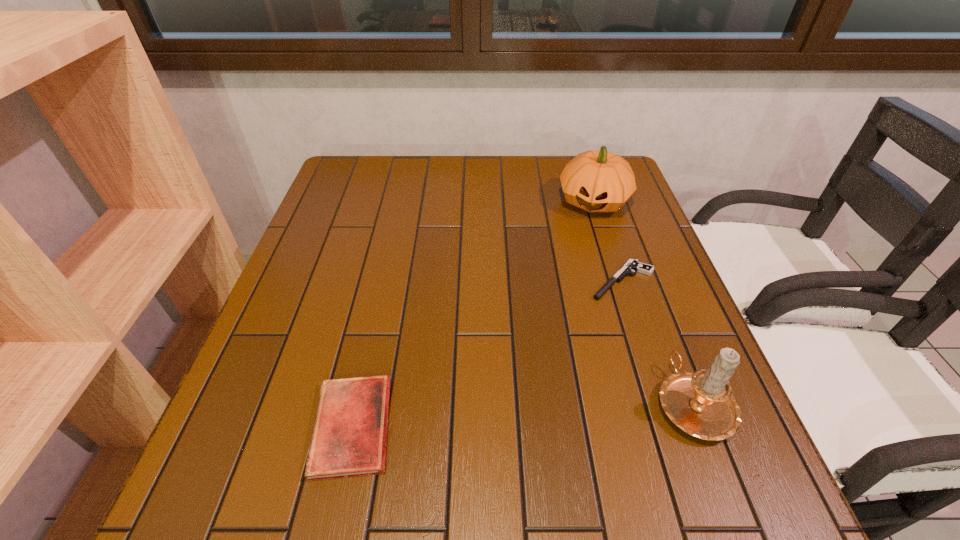
Locate an element on the screen. This screenshot has height=540, width=960. diary is located at coordinates (349, 438).

The height and width of the screenshot is (540, 960). Identify the location of the third tallest object. (349, 438).

Locate an element on the screen. This screenshot has width=960, height=540. candle is located at coordinates (701, 403).

Locate an element on the screen. The height and width of the screenshot is (540, 960). pistol is located at coordinates (633, 265).

Locate an element on the screen. The image size is (960, 540). the shortest object is located at coordinates (633, 265).

In order to click on gourd in this screenshot , I will do `click(595, 181)`.

The width and height of the screenshot is (960, 540). Find the location of `free space located 0.090m on the back of the diary`. free space located 0.090m on the back of the diary is located at coordinates (372, 342).

Where is `free space located on the left of the candle`? free space located on the left of the candle is located at coordinates (518, 403).

Locate an element on the screen. This screenshot has height=540, width=960. vacant point located on the front-facing side of the shortest object is located at coordinates [514, 393].

At what (x,y) coordinates should I click in order to perform the action: click on blank space located on the front-facing side of the shortest object. Please return your answer as a coordinate pair (x, y). The image size is (960, 540). Looking at the image, I should click on (492, 415).